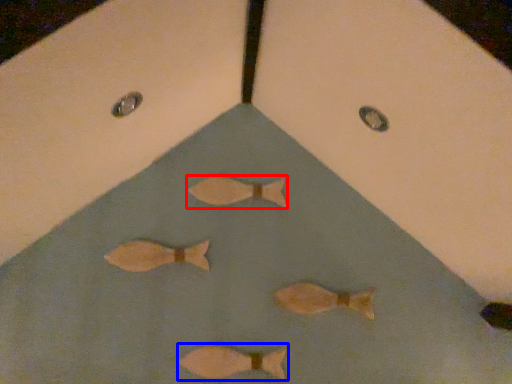
Question: Which object is further to the camera taking this photo, fish (highlighted by a red box) or fish (highlighted by a blue box)?

Choices:
 (A) fish
 (B) fish

Answer: (A)